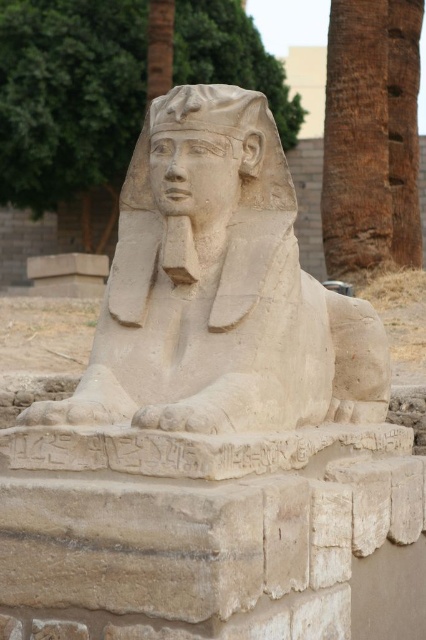
From the picture: Is brown textured palm tree at upper right behind beige stone head at center?

Yes, it is behind beige stone head at center.

Is brown textured palm tree at upper right wider than beige stone head at center?

Indeed, brown textured palm tree at upper right has a greater width compared to beige stone head at center.

Who is more distant from viewer, (389, 161) or (256, 134)?

Point (389, 161)

Image resolution: width=426 pixels, height=640 pixels. What are the coordinates of `brown textured palm tree at upper right` in the screenshot? It's located at (371, 134).

Between beige stone sphinx at center and beige stone head at center, which one is positioned lower?

beige stone sphinx at center

Can you confirm if beige stone sphinx at center is shorter than beige stone head at center?

No, beige stone sphinx at center is not shorter than beige stone head at center.

Does point (264, 182) come behind point (250, 134)?

Yes, point (264, 182) is farther from viewer.

At what (x,y) coordinates should I click in order to perform the action: click on beige stone sphinx at center. Please return your answer as a coordinate pair (x, y). The width and height of the screenshot is (426, 640). Looking at the image, I should click on (219, 291).

Is point (129, 316) more distant than point (344, 163)?

No, it is in front of (344, 163).

Is point (187, 172) behind point (397, 122)?

No, it is not.

You are a GUI agent. You are given a task and a screenshot of the screen. Output one action in this format:
    pyautogui.click(x=<x>, y=<y>)
    Task: Click on the beige stone sphinx at center
    Image resolution: width=426 pixels, height=640 pixels.
    Given the screenshot: What is the action you would take?
    pyautogui.click(x=219, y=291)